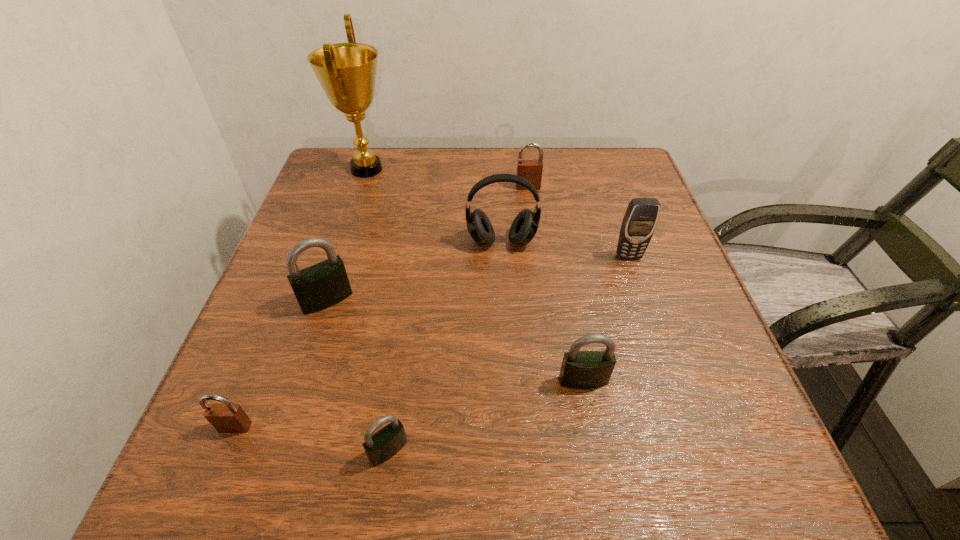
The image size is (960, 540). In order to click on free space located on the right of the third padlock from right to left in this screenshot , I will do [476, 450].

I want to click on vacant space located 0.080m on the front-facing side of the second nearest object, so click(x=209, y=490).

Where is `award that is at the far edge`? The image size is (960, 540). award that is at the far edge is located at coordinates (347, 72).

Identify the location of padlock present at the far edge. (531, 170).

I want to click on object that is positioned at the near edge, so click(x=384, y=444).

Where is `award that is at the left edge`? The width and height of the screenshot is (960, 540). award that is at the left edge is located at coordinates (347, 72).

The height and width of the screenshot is (540, 960). What are the coordinates of `object positioned at the right edge` in the screenshot? It's located at (640, 219).

What are the coordinates of `object situated at the far left corner` in the screenshot? It's located at (347, 72).

This screenshot has width=960, height=540. In the image, there is a desktop. Find the location of `free region at the far edge`. free region at the far edge is located at coordinates (409, 154).

You are a GUI agent. You are given a task and a screenshot of the screen. Output one action in this format:
    pyautogui.click(x=<x>, y=<y>)
    Task: Click on the vacant space at the right edge of the desktop
    This screenshot has width=960, height=540.
    Given the screenshot: What is the action you would take?
    pyautogui.click(x=681, y=369)